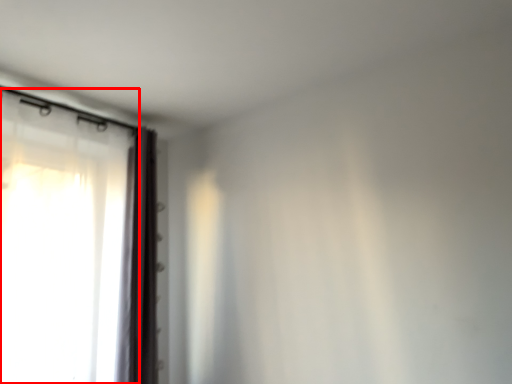
Question: From the image's perspective, considering the relative positions of curtain (annotated by the red box) and curtain in the image provided, where is curtain (annotated by the red box) located with respect to the staircase?

Choices:
 (A) below
 (B) above

Answer: (B)